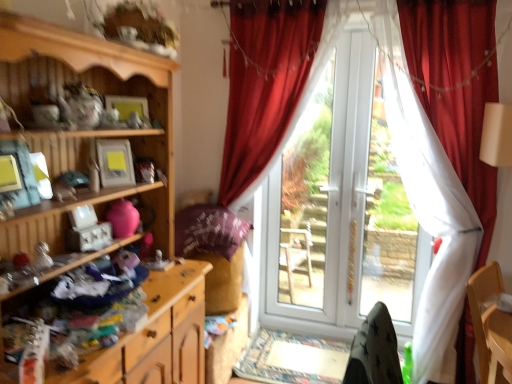
Describe the element at coordinates (271, 82) in the screenshot. The width and height of the screenshot is (512, 384). I see `velvet red curtain at center, which is counted as the 2th curtain, starting from the right` at that location.

The height and width of the screenshot is (384, 512). Describe the element at coordinates (339, 209) in the screenshot. I see `white glossy screen door at center` at that location.

In order to face white plastic door at center, which appears as the second bay window when viewed from the left, should I rotate leftwards or rightwards?

To align with it, rotate right about 17.901°.

Find the location of a particular element. velvet red curtain at right, placed as the second curtain when sorted from left to right is located at coordinates (457, 89).

In order to face velvet red curtain at right, placed as the second curtain when sorted from left to right, should I rotate leftwards or rightwards?

Rotate right and turn 22.863 degrees.

Identify the location of white plastic door at center, which appears as the 2th bay window when viewed from the right. This screenshot has width=512, height=384. (306, 200).

Between point (466, 99) and point (417, 259), which one is positioned behind?

The point (417, 259) is farther from the camera.

From the image's perspective, is velvet red curtain at right, placed as the second curtain when sorted from left to right, located above white plastic door at center, which appears as the second bay window when viewed from the left?

No, from the image's perspective, velvet red curtain at right, placed as the second curtain when sorted from left to right, is not over white plastic door at center, which appears as the second bay window when viewed from the left.

Which object is thinner, velvet red curtain at right, placed as the second curtain when sorted from left to right, or white plastic door at center, which appears as the second bay window when viewed from the left?

white plastic door at center, which appears as the second bay window when viewed from the left, is thinner.

Is velvet red curtain at right, the first curtain when ordered from right to left, smaller than white plastic door at center, which appears as the second bay window when viewed from the left?

Incorrect, velvet red curtain at right, the first curtain when ordered from right to left, is not smaller in size than white plastic door at center, which appears as the second bay window when viewed from the left.

Is velvet red curtain at center, which is counted as the 2th curtain, starting from the right, situated inside velvet red curtain at right, the first curtain when ordered from right to left, or outside?

velvet red curtain at center, which is counted as the 2th curtain, starting from the right, exists outside the volume of velvet red curtain at right, the first curtain when ordered from right to left.

Is velvet red curtain at center, which is counted as the 2th curtain, starting from the right, oriented towards velvet red curtain at right, the first curtain when ordered from right to left?

No, velvet red curtain at center, which is counted as the 2th curtain, starting from the right, does not turn towards velvet red curtain at right, the first curtain when ordered from right to left.

Relative to velvet red curtain at right, the first curtain when ordered from right to left, is velvet red curtain at center, which is counted as the 2th curtain, starting from the right, in front or behind?

velvet red curtain at center, which is counted as the 2th curtain, starting from the right, is positioned farther from the viewer than velvet red curtain at right, the first curtain when ordered from right to left.

Between velvet red curtain at center, which is counted as the 2th curtain, starting from the right, and velvet red curtain at right, placed as the second curtain when sorted from left to right, which one has smaller size?

velvet red curtain at center, which is counted as the 2th curtain, starting from the right.

Is velvet red curtain at right, the first curtain when ordered from right to left, further to the viewer compared to white plastic door at center, arranged as the first bay window when viewed from the left?

No, velvet red curtain at right, the first curtain when ordered from right to left, is closer to the viewer.

From a real-world perspective, relative to white plastic door at center, which appears as the 2th bay window when viewed from the right, is velvet red curtain at right, the first curtain when ordered from right to left, vertically above or below?

Clearly, from a real-world perspective, velvet red curtain at right, the first curtain when ordered from right to left, is above white plastic door at center, which appears as the 2th bay window when viewed from the right.

Would you say white glossy screen door at center is a long distance from wooden dresser at lower left, which ranks as the 2th cabinetry in top-to-bottom order?

Absolutely, white glossy screen door at center is distant from wooden dresser at lower left, which ranks as the 2th cabinetry in top-to-bottom order.

From the image's perspective, would you say white glossy screen door at center is positioned over wooden dresser at lower left, which ranks as the 2th cabinetry in top-to-bottom order?

Yes, from the image's perspective, white glossy screen door at center is on top of wooden dresser at lower left, which ranks as the 2th cabinetry in top-to-bottom order.

Find the location of a particular element. the 2nd cabinetry directly beneath the white glossy screen door at center (from a real-world perspective) is located at coordinates (154, 336).

Which object is wider, white glossy screen door at center or wooden dresser at lower left, acting as the 1th cabinetry starting from the bottom?

With larger width is wooden dresser at lower left, acting as the 1th cabinetry starting from the bottom.

Are wooden dresser at lower left, which ranks as the 2th cabinetry in top-to-bottom order, and velvet red curtain at center, which is counted as the 2th curtain, starting from the right, beside each other?

There is a gap between wooden dresser at lower left, which ranks as the 2th cabinetry in top-to-bottom order, and velvet red curtain at center, which is counted as the 2th curtain, starting from the right.

Is wooden dresser at lower left, acting as the 1th cabinetry starting from the bottom, turned away from velvet red curtain at center, which ranks as the first curtain in left-to-right order?

No, velvet red curtain at center, which ranks as the first curtain in left-to-right order, is not at the back of wooden dresser at lower left, acting as the 1th cabinetry starting from the bottom.

Consider the image. Is wooden dresser at lower left, acting as the 1th cabinetry starting from the bottom, situated inside velvet red curtain at center, which is counted as the 2th curtain, starting from the right, or outside?

wooden dresser at lower left, acting as the 1th cabinetry starting from the bottom, is located beyond the bounds of velvet red curtain at center, which is counted as the 2th curtain, starting from the right.

Is white plastic door at center, which is the 1th bay window in right-to-left order, oriented towards velvet red curtain at center, which is counted as the 2th curtain, starting from the right?

No, white plastic door at center, which is the 1th bay window in right-to-left order, is not oriented towards velvet red curtain at center, which is counted as the 2th curtain, starting from the right.

Looking at their sizes, would you say white plastic door at center, which appears as the second bay window when viewed from the left, is wider or thinner than velvet red curtain at center, which is counted as the 2th curtain, starting from the right?

white plastic door at center, which appears as the second bay window when viewed from the left, is thinner than velvet red curtain at center, which is counted as the 2th curtain, starting from the right.

Choose the correct answer: Is white plastic door at center, which appears as the second bay window when viewed from the left, inside velvet red curtain at center, which ranks as the first curtain in left-to-right order, or outside it?

white plastic door at center, which appears as the second bay window when viewed from the left, cannot be found inside velvet red curtain at center, which ranks as the first curtain in left-to-right order.

Is velvet red curtain at center, which ranks as the first curtain in left-to-right order, situated inside white plastic door at center, arranged as the first bay window when viewed from the left, or outside?

velvet red curtain at center, which ranks as the first curtain in left-to-right order, exists outside the volume of white plastic door at center, arranged as the first bay window when viewed from the left.

Between velvet red curtain at center, which is counted as the 2th curtain, starting from the right, and white plastic door at center, which appears as the 2th bay window when viewed from the right, which one has more height?

velvet red curtain at center, which is counted as the 2th curtain, starting from the right.

Where is `the 1st bay window below the velvet red curtain at center, which is counted as the 2th curtain, starting from the right (from the image's perspective)`? This screenshot has width=512, height=384. the 1st bay window below the velvet red curtain at center, which is counted as the 2th curtain, starting from the right (from the image's perspective) is located at coordinates pyautogui.click(x=306, y=200).

What's the angular difference between velvet red curtain at center, which is counted as the 2th curtain, starting from the right, and white plastic door at center, which appears as the 2th bay window when viewed from the right,'s facing directions?

The angle between the facing direction of velvet red curtain at center, which is counted as the 2th curtain, starting from the right, and the facing direction of white plastic door at center, which appears as the 2th bay window when viewed from the right, is 0.556 degrees.

Identify the location of the 1st curtain located above the white plastic door at center, which is the 1th bay window in right-to-left order (from a real-world perspective). [x=457, y=89].

Where is `curtain above the velvet red curtain at right, the first curtain when ordered from right to left (from the image's perspective)`? curtain above the velvet red curtain at right, the first curtain when ordered from right to left (from the image's perspective) is located at coordinates (271, 82).

When comparing their distances from wooden cabinet at left, the second cabinetry positioned from the bottom, does white glossy screen door at center or velvet red curtain at right, placed as the second curtain when sorted from left to right, seem closer?

white glossy screen door at center.

From the image, which object appears to be farther from velvet red curtain at right, the first curtain when ordered from right to left, velvet red curtain at center, which is counted as the 2th curtain, starting from the right, or white glossy screen door at center?

white glossy screen door at center lies further to velvet red curtain at right, the first curtain when ordered from right to left, than the other object.

When comparing their distances from white plastic door at center, which appears as the 2th bay window when viewed from the right, does velvet red curtain at right, placed as the second curtain when sorted from left to right, or wooden dresser at lower left, acting as the 1th cabinetry starting from the bottom, seem closer?

Based on the image, velvet red curtain at right, placed as the second curtain when sorted from left to right, appears to be nearer to white plastic door at center, which appears as the 2th bay window when viewed from the right.

From the image, which object appears to be nearer to white plastic door at center, which appears as the second bay window when viewed from the left, velvet red curtain at right, the first curtain when ordered from right to left, or white glossy screen door at center?

Based on the image, white glossy screen door at center appears to be nearer to white plastic door at center, which appears as the second bay window when viewed from the left.

Which object lies further to the anchor point white plastic door at center, which appears as the second bay window when viewed from the left, velvet red curtain at center, which ranks as the first curtain in left-to-right order, or white plastic door at center, arranged as the first bay window when viewed from the left?

Among the two, white plastic door at center, arranged as the first bay window when viewed from the left, is located further to white plastic door at center, which appears as the second bay window when viewed from the left.

Which object lies nearer to the anchor point wooden dresser at lower left, which ranks as the 2th cabinetry in top-to-bottom order, white glossy screen door at center or white plastic door at center, arranged as the first bay window when viewed from the left?

The object closer to wooden dresser at lower left, which ranks as the 2th cabinetry in top-to-bottom order, is white glossy screen door at center.

Based on their spatial positions, is white plastic door at center, which appears as the 2th bay window when viewed from the right, or velvet red curtain at right, placed as the second curtain when sorted from left to right, closer to wooden dresser at lower left, which ranks as the 2th cabinetry in top-to-bottom order?

velvet red curtain at right, placed as the second curtain when sorted from left to right, is positioned closer to the anchor wooden dresser at lower left, which ranks as the 2th cabinetry in top-to-bottom order.

Looking at the image, which one is located further to wooden dresser at lower left, acting as the 1th cabinetry starting from the bottom, velvet red curtain at center, which ranks as the first curtain in left-to-right order, or white plastic door at center, which appears as the second bay window when viewed from the left?

Based on the image, white plastic door at center, which appears as the second bay window when viewed from the left, appears to be further to wooden dresser at lower left, acting as the 1th cabinetry starting from the bottom.

The height and width of the screenshot is (384, 512). In order to click on screen door between velvet red curtain at right, the first curtain when ordered from right to left, and white plastic door at center, which appears as the second bay window when viewed from the left, along the z-axis in this screenshot , I will do `click(339, 209)`.

Locate an element on the screen. The height and width of the screenshot is (384, 512). bay window located between wooden dresser at lower left, acting as the 1th cabinetry starting from the bottom, and white plastic door at center, arranged as the first bay window when viewed from the left, in the depth direction is located at coordinates (388, 224).

Locate an element on the screen. This screenshot has height=384, width=512. bay window positioned between velvet red curtain at right, placed as the second curtain when sorted from left to right, and white plastic door at center, arranged as the first bay window when viewed from the left, from near to far is located at coordinates (388, 224).

At what (x,y) coordinates should I click in order to perform the action: click on screen door between white plastic door at center, which appears as the 2th bay window when viewed from the right, and white plastic door at center, which is the 1th bay window in right-to-left order, in the horizontal direction. Please return your answer as a coordinate pair (x, y). The height and width of the screenshot is (384, 512). Looking at the image, I should click on (339, 209).